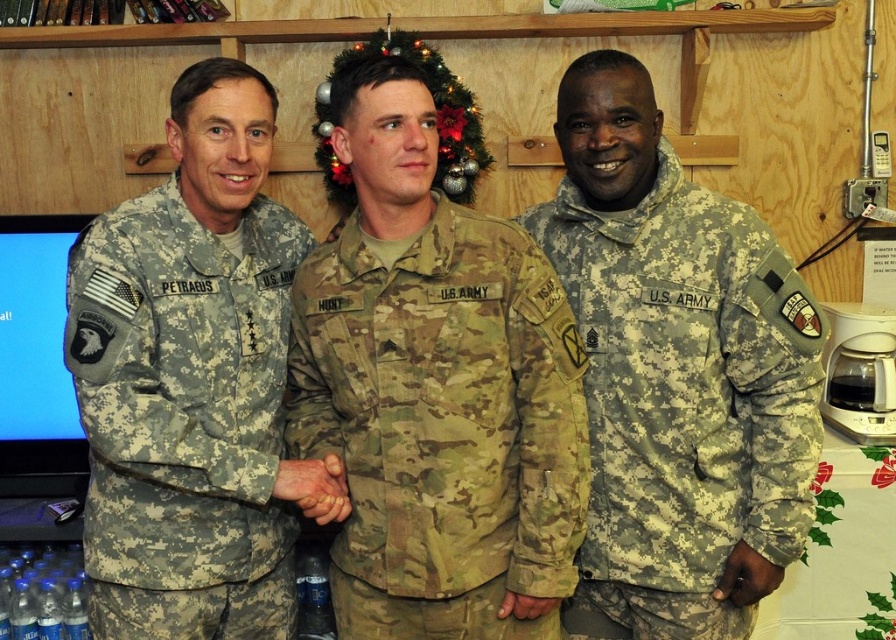
Which is more to the right, camouflage fabric uniform at center or matte camouflage hand at center?

matte camouflage hand at center

Does camouflage fabric uniform at center have a greater width compared to matte camouflage hand at center?

Indeed, camouflage fabric uniform at center has a greater width compared to matte camouflage hand at center.

This screenshot has height=640, width=896. Identify the location of camouflage fabric uniform at center. (442, 426).

This screenshot has height=640, width=896. I want to click on camouflage fabric uniform at center, so click(x=442, y=426).

Consider the image. Is camouflage uniform at center behind camouflage fabric uniform at left?

Yes, camouflage uniform at center is further from the viewer.

Measure the distance between camouflage uniform at center and camouflage fabric uniform at left.

camouflage uniform at center and camouflage fabric uniform at left are 22.34 inches apart from each other.

The width and height of the screenshot is (896, 640). What are the coordinates of `camouflage uniform at center` in the screenshot? It's located at (674, 369).

Identify the location of camouflage uniform at center. This screenshot has height=640, width=896. (674, 369).

Where is `camouflage fabric uniform at center`? camouflage fabric uniform at center is located at coordinates (442, 426).

Which is more to the right, camouflage fabric uniform at center or camouflage fabric uniform at left?

camouflage fabric uniform at center is more to the right.

Identify the location of camouflage fabric uniform at center. (442, 426).

Find the location of `camouflage fabric uniform at center`. camouflage fabric uniform at center is located at coordinates tap(442, 426).